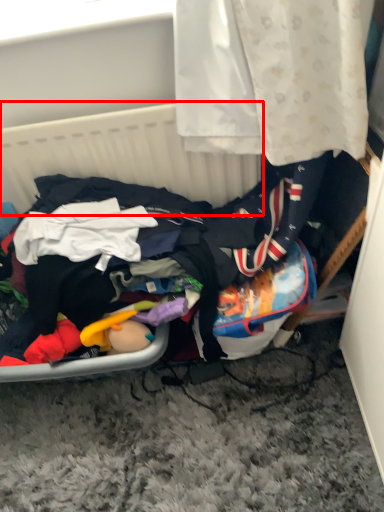
Question: From the image's perspective, where is basket (annotated by the red box) located relative to clothing?

Choices:
 (A) above
 (B) below

Answer: (A)